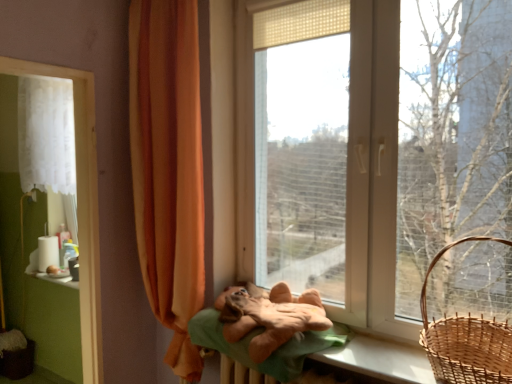
Question: Should I look upward or downward to see woven brown basket at right?

Choices:
 (A) up
 (B) down

Answer: (B)

Question: Is the surface of soft brown plush at center in direct contact with woven brown basket at right?

Choices:
 (A) yes
 (B) no

Answer: (B)

Question: Would you say soft brown plush at center is a long distance from woven brown basket at right?

Choices:
 (A) yes
 (B) no

Answer: (B)

Question: Is soft brown plush at center positioned with its back to woven brown basket at right?

Choices:
 (A) yes
 (B) no

Answer: (B)

Question: From the image's perspective, does soft brown plush at center appear lower than woven brown basket at right?

Choices:
 (A) no
 (B) yes

Answer: (B)

Question: Is soft brown plush at center positioned behind woven brown basket at right?

Choices:
 (A) no
 (B) yes

Answer: (B)

Question: From a real-world perspective, is soft brown plush at center on woven brown basket at right?

Choices:
 (A) yes
 (B) no

Answer: (B)

Question: Considering the relative positions of white sheer curtain at left, which appears as the first curtain when viewed from the back, and brown woven basket at lower left in the image provided, is white sheer curtain at left, which appears as the first curtain when viewed from the back, to the right of brown woven basket at lower left from the viewer's perspective?

Choices:
 (A) no
 (B) yes

Answer: (B)

Question: Can you confirm if white sheer curtain at left, which appears as the first curtain when viewed from the back, is wider than brown woven basket at lower left?

Choices:
 (A) no
 (B) yes

Answer: (A)

Question: Is white sheer curtain at left, which ranks as the second curtain in front-to-back order, placed right next to brown woven basket at lower left?

Choices:
 (A) no
 (B) yes

Answer: (A)

Question: Does white sheer curtain at left, the first curtain from the left, have a greater height compared to brown woven basket at lower left?

Choices:
 (A) no
 (B) yes

Answer: (B)

Question: Is there a large distance between white sheer curtain at left, which appears as the first curtain when viewed from the back, and brown woven basket at lower left?

Choices:
 (A) no
 (B) yes

Answer: (B)

Question: From the image's perspective, would you say white sheer curtain at left, acting as the second curtain starting from the right, is shown under brown woven basket at lower left?

Choices:
 (A) no
 (B) yes

Answer: (A)

Question: Does white sheer curtain at left, the first curtain from the left, touch soft brown plush at center?

Choices:
 (A) yes
 (B) no

Answer: (B)